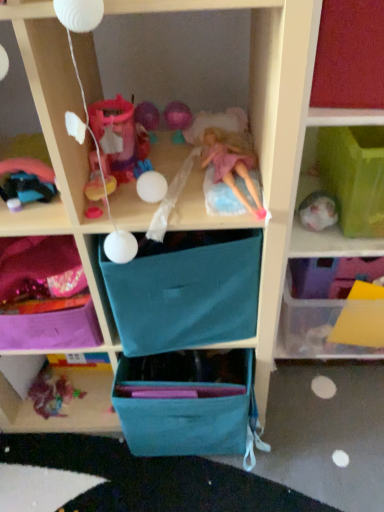
The height and width of the screenshot is (512, 384). I want to click on vacant space in front of multicolored fabric toy at lower left, arranged as the 1th toy when viewed from the back, so click(x=38, y=440).